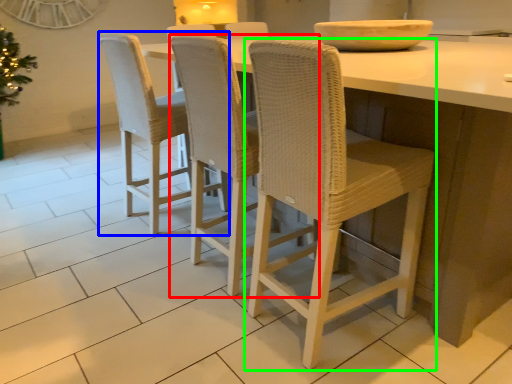
Question: Which is nearer to the chair (highlighted by a red box)? chair (highlighted by a blue box) or chair (highlighted by a green box).

Choices:
 (A) chair
 (B) chair

Answer: (B)